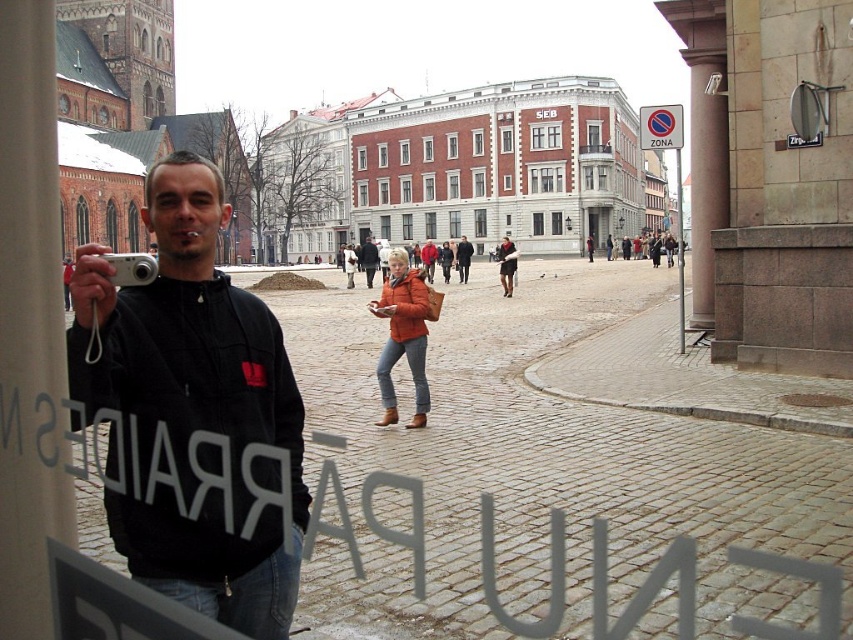
Does brown leather jacket at center appear over matte black jacket at center?

Correct, brown leather jacket at center is located above matte black jacket at center.

Between point (370, 253) and point (461, 268), which one is positioned behind?

Point (370, 253)

This screenshot has height=640, width=853. Find the location of `brown leather jacket at center`. brown leather jacket at center is located at coordinates (368, 259).

Is black corduroy jacket at left bigger than silver metallic camera at left?

Actually, black corduroy jacket at left might be smaller than silver metallic camera at left.

Which is more to the left, black corduroy jacket at left or silver metallic camera at left?

silver metallic camera at left is more to the left.

Does point (184, 572) come in front of point (125, 262)?

Yes.

The image size is (853, 640). I want to click on black corduroy jacket at left, so click(x=189, y=326).

Is the position of silver metallic camera at left more distant than that of orange leather jacket at center?

No, silver metallic camera at left is closer to the viewer.

Does silver metallic camera at left appear under orange leather jacket at center?

Yes.

The height and width of the screenshot is (640, 853). What do you see at coordinates (131, 268) in the screenshot? I see `silver metallic camera at left` at bounding box center [131, 268].

Locate an element on the screen. The width and height of the screenshot is (853, 640). silver metallic camera at left is located at coordinates (131, 268).